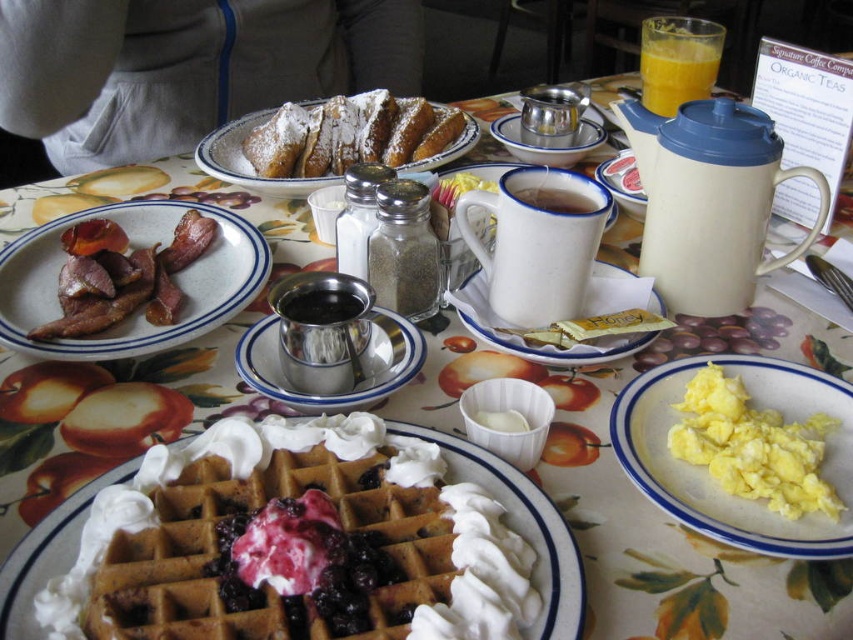
Does brown crispy bacon at left appear on the right side of white matte mug at center?

Incorrect, brown crispy bacon at left is not on the right side of white matte mug at center.

Is point (172, 346) in front of point (537, 196)?

That is True.

Does point (138, 333) come closer to viewer compared to point (561, 189)?

That is True.

Locate an element on the screen. This screenshot has height=640, width=853. brown crispy bacon at left is located at coordinates (138, 312).

Is translucent plastic cup at upper right to the left of shiny metallic pot at center from the viewer's perspective?

No, translucent plastic cup at upper right is not to the left of shiny metallic pot at center.

Is translucent plastic cup at upper right closer to the viewer compared to shiny metallic pot at center?

No, translucent plastic cup at upper right is further to the viewer.

Is point (720, 44) more distant than point (346, 301)?

Yes, it is behind point (346, 301).

Locate an element on the screen. The width and height of the screenshot is (853, 640). translucent plastic cup at upper right is located at coordinates (677, 60).

Does brown crispy bacon at left have a lesser width compared to silver metallic syrup container at center?

No, brown crispy bacon at left is not thinner than silver metallic syrup container at center.

Between point (138, 216) and point (259, 390), which one is positioned behind?

Positioned behind is point (138, 216).

Is point (54, 256) farther from camera compared to point (263, 320)?

Yes, it is behind point (263, 320).

The width and height of the screenshot is (853, 640). Find the location of `brown crispy bacon at left`. brown crispy bacon at left is located at coordinates (138, 312).